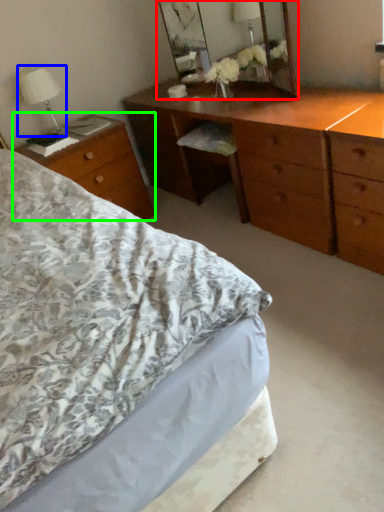
Question: Considering the real-world distances, which object is closest to mirror (highlighted by a red box)? bedside lamp (highlighted by a blue box) or desk (highlighted by a green box).

Choices:
 (A) bedside lamp
 (B) desk

Answer: (B)